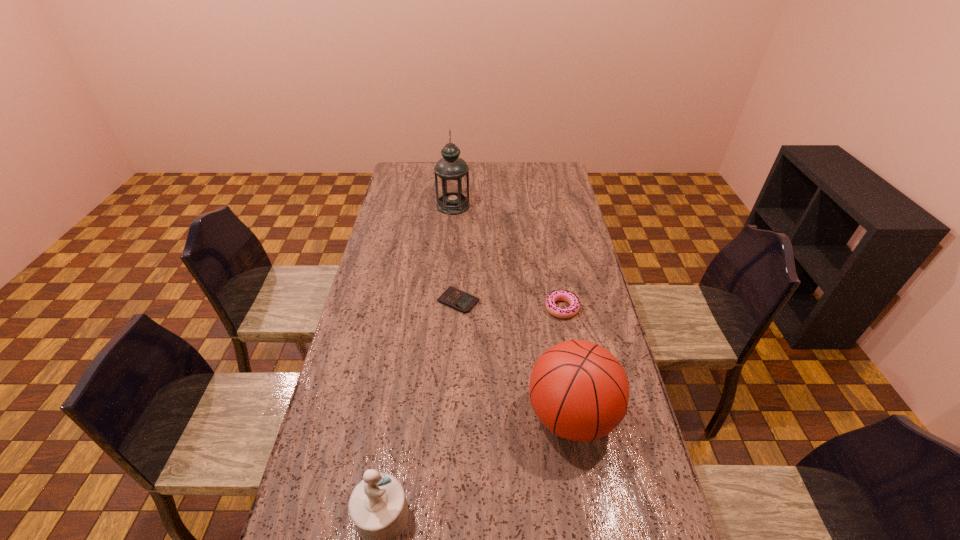
Image resolution: width=960 pixels, height=540 pixels. I want to click on basketball at the right edge, so click(578, 389).

Image resolution: width=960 pixels, height=540 pixels. In order to click on doughnut present at the right edge in this screenshot , I will do `click(559, 295)`.

At what (x,y) coordinates should I click in order to perform the action: click on blank space at the far edge of the desktop. Please return your answer as a coordinate pair (x, y). This screenshot has width=960, height=540. Looking at the image, I should click on (433, 163).

Image resolution: width=960 pixels, height=540 pixels. In the image, there is a desktop. Identify the location of blank space at the left edge. (334, 472).

The image size is (960, 540). Identify the location of vacant region at the right edge of the desktop. (597, 303).

Find the location of a particular element. Image resolution: width=960 pixels, height=540 pixels. free region at the far left corner of the desktop is located at coordinates (414, 170).

Where is `free space between the fourth farthest object and the shortest object`? The width and height of the screenshot is (960, 540). free space between the fourth farthest object and the shortest object is located at coordinates (515, 359).

Where is `free space that is in between the second nearest object and the shortest object`? free space that is in between the second nearest object and the shortest object is located at coordinates (515, 359).

Find the location of `free space that is in between the calculator and the fourth farthest object`. free space that is in between the calculator and the fourth farthest object is located at coordinates (515, 359).

The height and width of the screenshot is (540, 960). I want to click on empty space that is in between the tallest object and the shortest object, so click(456, 253).